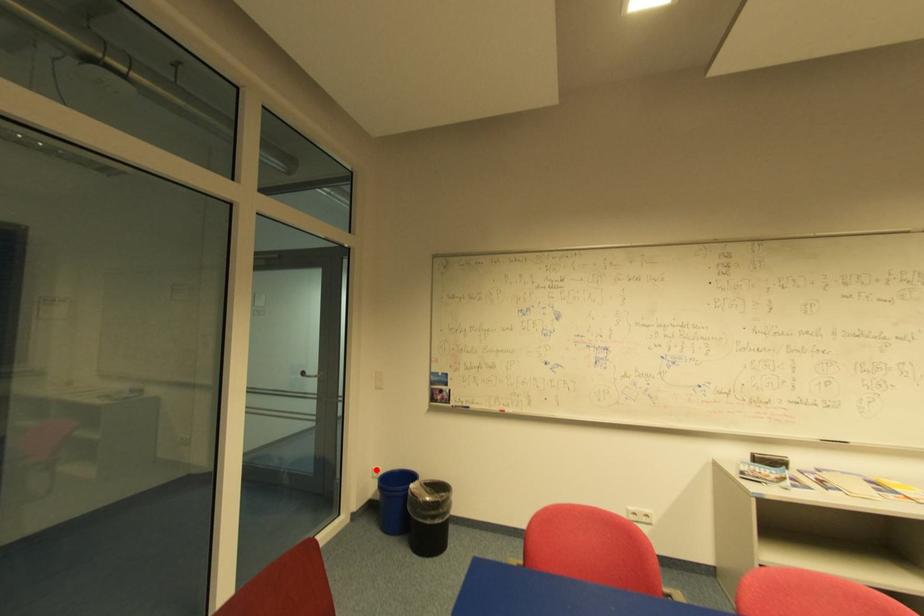
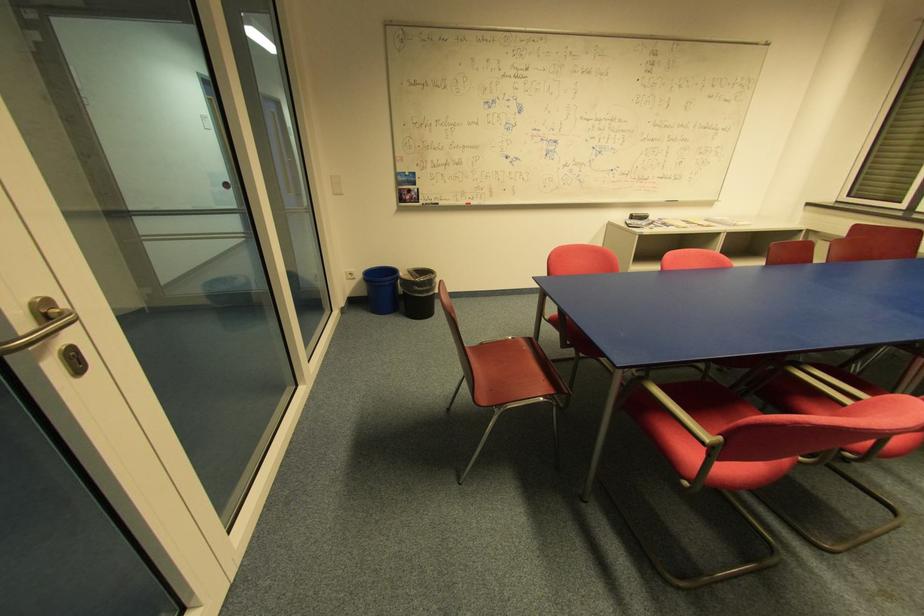
Find the pixel in the second image that matches the highlighted location in the first image.

(349, 274)